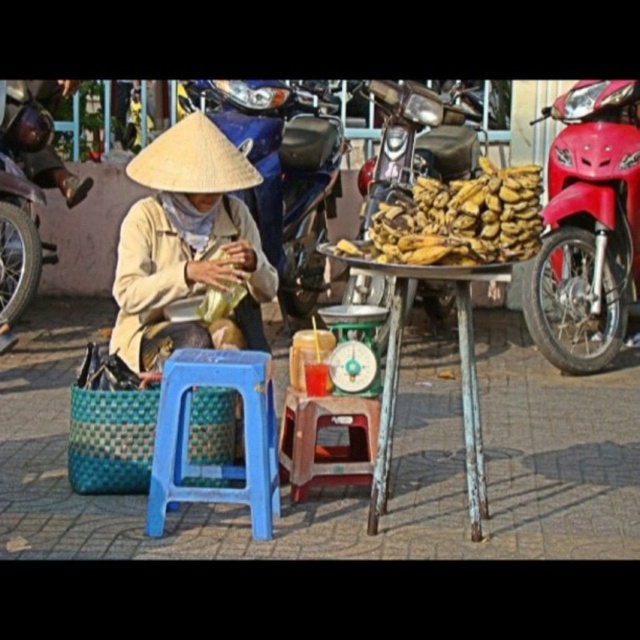
You are a customer at the street vendor stall. You notice the matte straw hat at center and the metallic silver motorcycle at upper center. Which object takes up more space in the scene?

The metallic silver motorcycle at upper center takes up more space in the scene because it is larger than the matte straw hat at center.